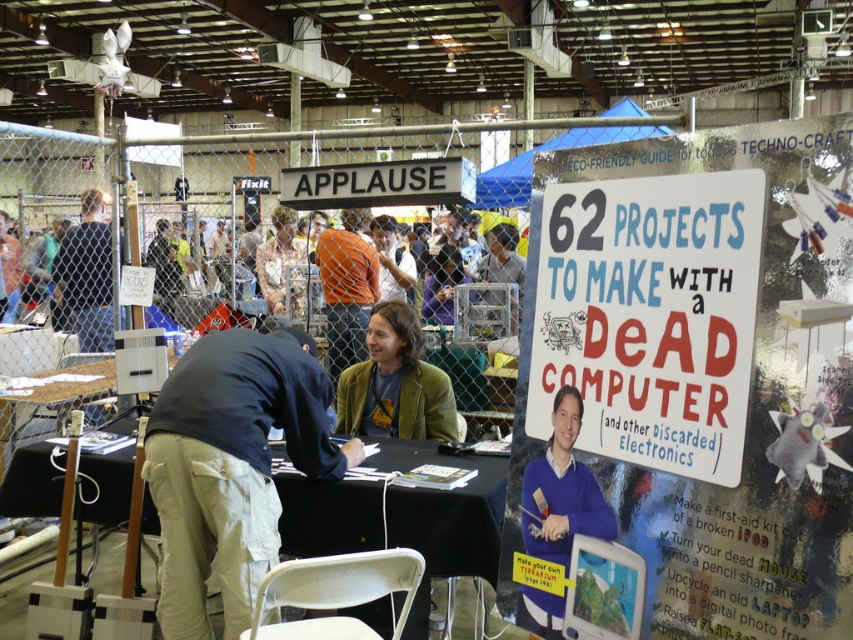
The image size is (853, 640). Describe the element at coordinates (444, 518) in the screenshot. I see `black fabric table at center` at that location.

Which of these two, black fabric table at center or purple fabric shirt at center, stands taller?

purple fabric shirt at center is taller.

Is point (474, 458) positioned behind point (456, 273)?

No, it is in front of (456, 273).

Where is `black fabric table at center`? The width and height of the screenshot is (853, 640). black fabric table at center is located at coordinates (444, 518).

Does khaki pants at center appear over black fabric table at center?

Correct, khaki pants at center is located above black fabric table at center.

Does khaki pants at center have a greater height compared to black fabric table at center?

Correct, khaki pants at center is much taller as black fabric table at center.

Where is `khaki pants at center`? This screenshot has height=640, width=853. khaki pants at center is located at coordinates (231, 467).

Does blue sweater at center have a greater width compared to dark blue shirt at center?

In fact, blue sweater at center might be narrower than dark blue shirt at center.

Who is positioned more to the left, blue sweater at center or dark blue shirt at center?

dark blue shirt at center

Is point (560, 412) farther from camera compared to point (109, 236)?

No, it is not.

What are the coordinates of `blue sweater at center` in the screenshot? It's located at (561, 490).